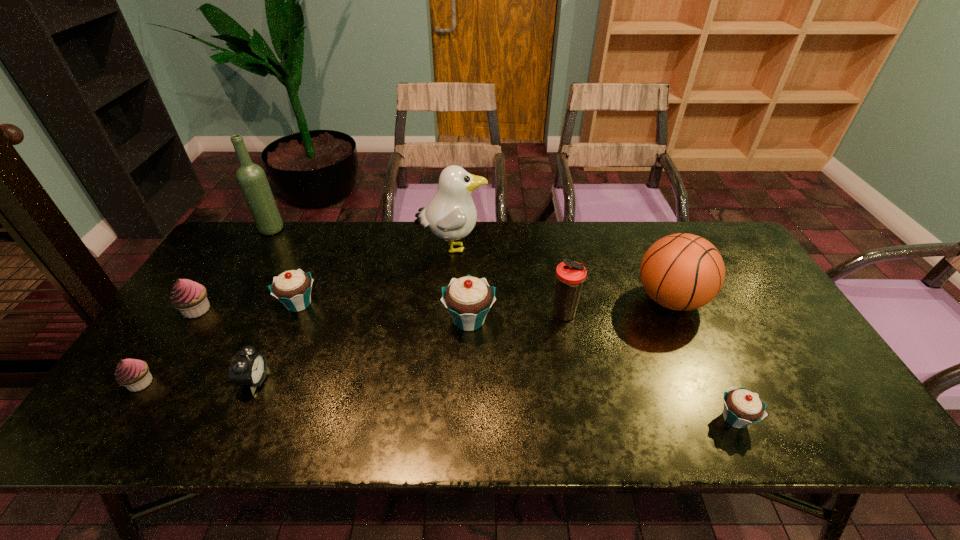
Where is `object at the far left corner`? object at the far left corner is located at coordinates (252, 179).

Locate an element on the screen. This screenshot has height=540, width=960. blank area at the far edge is located at coordinates (422, 232).

In the image, there is a desktop. Identify the location of vacant space at the left edge. The width and height of the screenshot is (960, 540). (180, 315).

The width and height of the screenshot is (960, 540). I want to click on free point at the right edge, so click(x=804, y=352).

Image resolution: width=960 pixels, height=540 pixels. In the image, there is a desktop. Identify the location of vacant area at the far left corner. (256, 231).

I want to click on vacant position at the far right corner of the desktop, so (x=718, y=230).

Locate an element on the screen. The width and height of the screenshot is (960, 540). vacant space at the near right corner of the desktop is located at coordinates (858, 441).

You are a GUI agent. You are given a task and a screenshot of the screen. Output one action in this format:
    pyautogui.click(x=<x>, y=<y>)
    Task: Click on the empty space between the green wine bottle and the third object from right to left
    
    Given the screenshot: What is the action you would take?
    pyautogui.click(x=419, y=272)

Identify the location of free space between the leftmost teal cupcake and the nearest object. (516, 361).

What are the coordinates of `unoccupied area between the smaller pink cupcake and the white gull` in the screenshot? It's located at (297, 315).